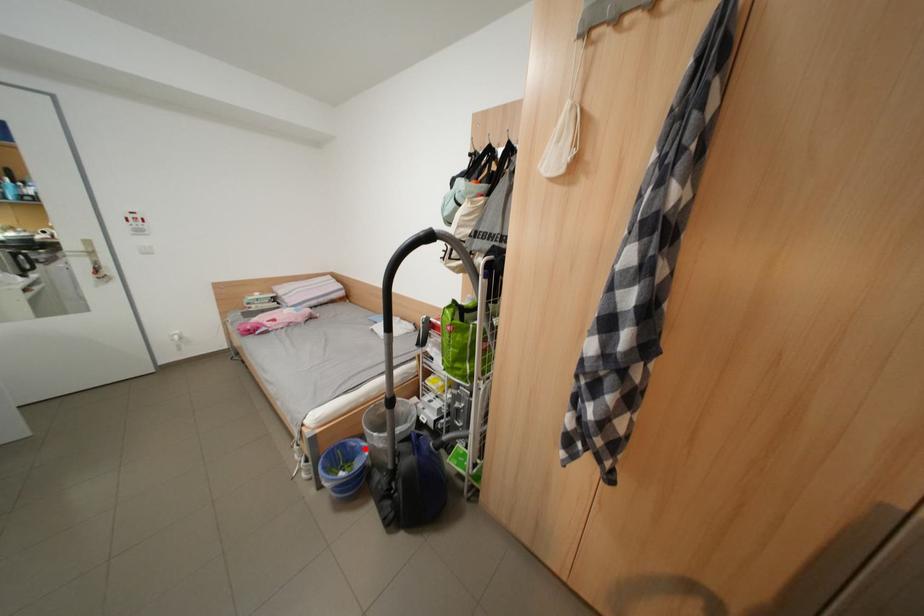
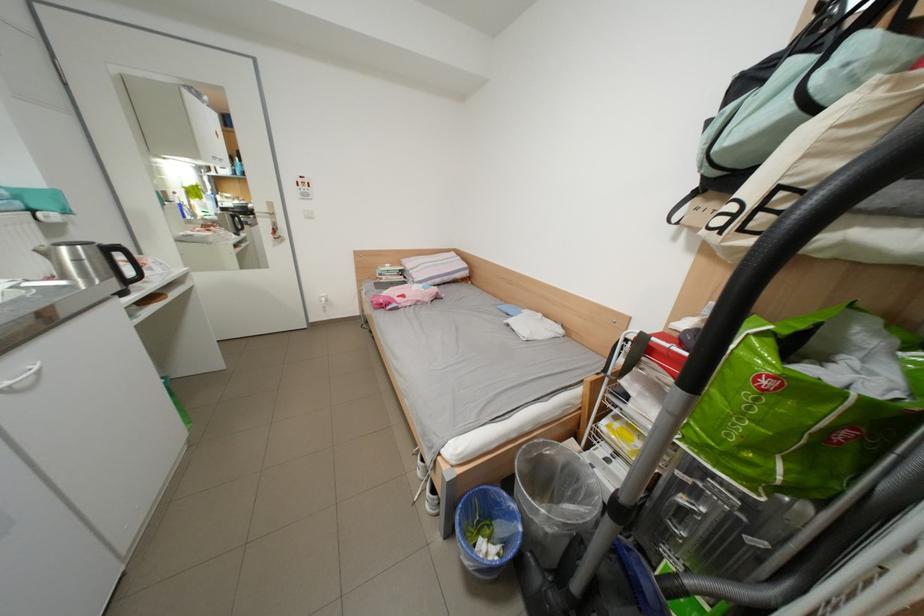
Question: I am providing you with two images of the same scene from different viewpoints. In image1, a red point is highlighted. Considering the same 3D point in image2, which of the following is correct?

Choices:
 (A) It is closer
 (B) It is farther

Answer: (A)